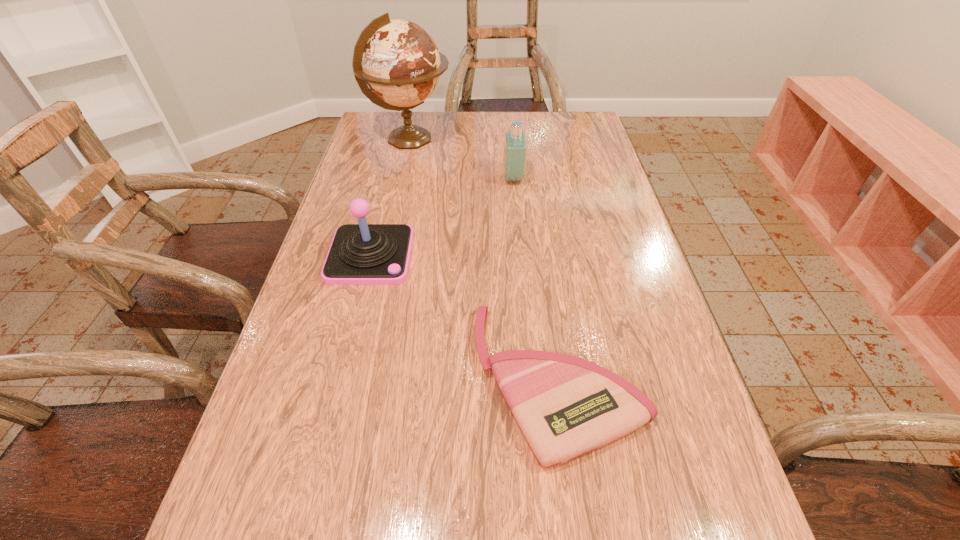
Where is `free space located forward from the base of the second nearest object`? The height and width of the screenshot is (540, 960). free space located forward from the base of the second nearest object is located at coordinates (350, 338).

Identify the location of free region located 0.300m on the left of the nearest object. This screenshot has height=540, width=960. (309, 380).

Locate an element on the screen. This screenshot has height=540, width=960. object present at the far edge is located at coordinates (399, 61).

Where is `globe positioned at the left edge`? globe positioned at the left edge is located at coordinates (399, 61).

The width and height of the screenshot is (960, 540). Identify the location of joystick that is at the left edge. (360, 254).

Image resolution: width=960 pixels, height=540 pixels. In order to click on object at the right edge in this screenshot , I will do `click(565, 406)`.

The width and height of the screenshot is (960, 540). I want to click on object positioned at the far left corner, so click(399, 61).

Find the location of a particular element. This screenshot has width=960, height=540. vacant space at the far edge is located at coordinates (446, 143).

This screenshot has height=540, width=960. I want to click on vacant space at the left edge, so click(x=336, y=361).

In the image, there is a desktop. Identify the location of vacant space at the right edge. (708, 450).